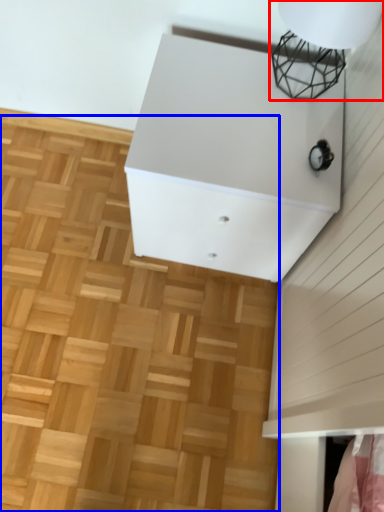
Question: Which object appears farthest to the camera in this image, lamp (highlighted by a red box) or hardwood (highlighted by a blue box)?

Choices:
 (A) lamp
 (B) hardwood

Answer: (B)